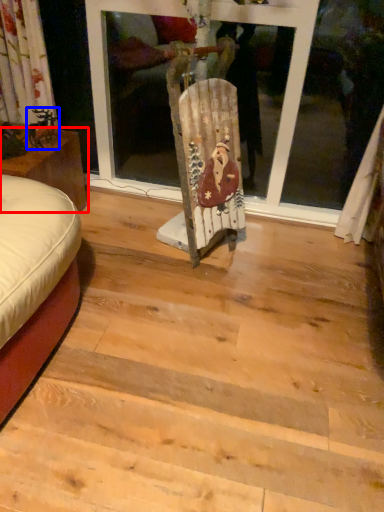
Question: Which of the following is the farthest to the observer, furniture (highlighted by a red box) or art (highlighted by a blue box)?

Choices:
 (A) furniture
 (B) art

Answer: (B)